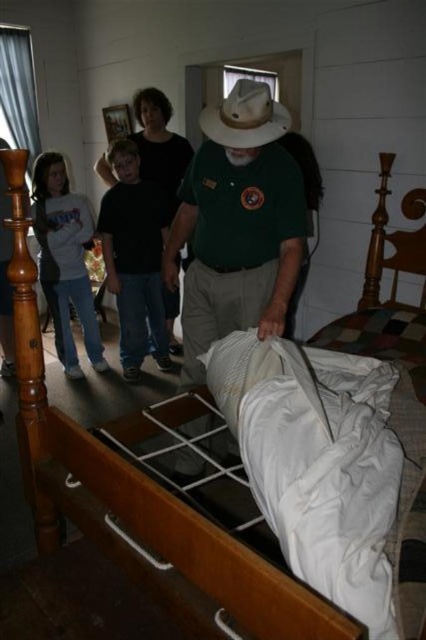
Describe the element at coordinates (238, 225) in the screenshot. I see `green cotton shirt at center` at that location.

Based on the photo, does green cotton shirt at center have a greater width compared to gray sweatshirt at left?

Yes, green cotton shirt at center is wider than gray sweatshirt at left.

In order to click on green cotton shirt at center in this screenshot , I will do `click(238, 225)`.

The height and width of the screenshot is (640, 426). In order to click on green cotton shirt at center in this screenshot , I will do `click(238, 225)`.

Which is in front, point (294, 173) or point (262, 129)?

Point (262, 129) is in front.

Identify the location of green cotton shirt at center. This screenshot has width=426, height=640. (238, 225).

The width and height of the screenshot is (426, 640). Describe the element at coordinates (238, 225) in the screenshot. I see `green cotton shirt at center` at that location.

In order to click on green cotton shirt at center in this screenshot , I will do `click(238, 225)`.

Does black cotton shirt at center come behind white matte cowboy hat at center?

Yes, black cotton shirt at center is further from the viewer.

Which of these two, black cotton shirt at center or white matte cowboy hat at center, stands shorter?

With less height is white matte cowboy hat at center.

Does point (147, 241) lie behind point (198, 122)?

Yes, point (147, 241) is farther from viewer.

Locate an element on the screen. black cotton shirt at center is located at coordinates (135, 259).